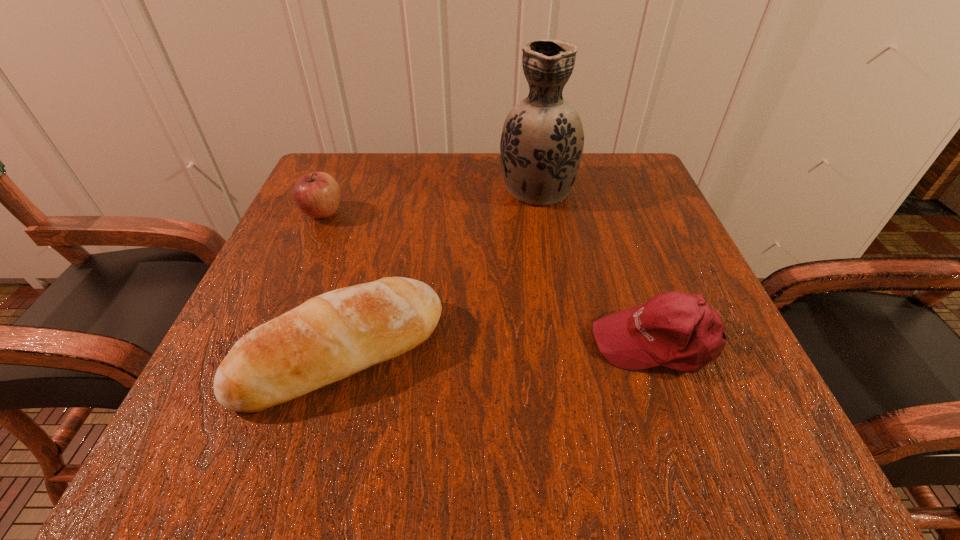
The image size is (960, 540). Find the location of `vase`. vase is located at coordinates (542, 140).

I want to click on apple, so click(318, 195).

The width and height of the screenshot is (960, 540). Find the location of `bread`. bread is located at coordinates (332, 336).

This screenshot has height=540, width=960. I want to click on baseball cap, so click(x=679, y=331).

Where is `free region located on the right of the apple`? The width and height of the screenshot is (960, 540). free region located on the right of the apple is located at coordinates (494, 213).

This screenshot has height=540, width=960. Identify the location of free space located on the back of the bread. (389, 180).

Locate an element on the screen. free space located 0.280m at the front of the baseball cap with the brim is located at coordinates (408, 342).

You are a GUI agent. You are given a task and a screenshot of the screen. Output one action in this format:
    pyautogui.click(x=<x>, y=<y>)
    Task: Click on the free point located 0.100m at the front of the baseball cap with the brim
    The height and width of the screenshot is (540, 960).
    Given the screenshot: What is the action you would take?
    pyautogui.click(x=527, y=342)

You are a GUI agent. You are given a task and a screenshot of the screen. Output one action in this format:
    pyautogui.click(x=<x>, y=<y>)
    Task: Click on the vacant space positioned 0.090m at the front of the baseball cap with the brim
    This screenshot has width=960, height=540.
    Given the screenshot: What is the action you would take?
    pyautogui.click(x=534, y=342)

Identify the location of vase at the far edge. This screenshot has width=960, height=540. (542, 140).